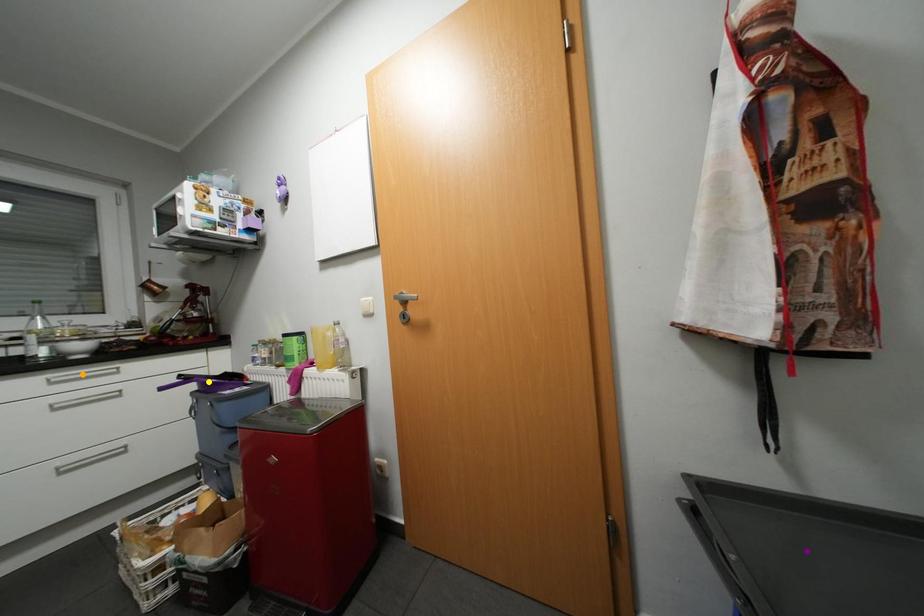
Order these from nearest to farthest:
orange point, yellow point, purple point

purple point
orange point
yellow point